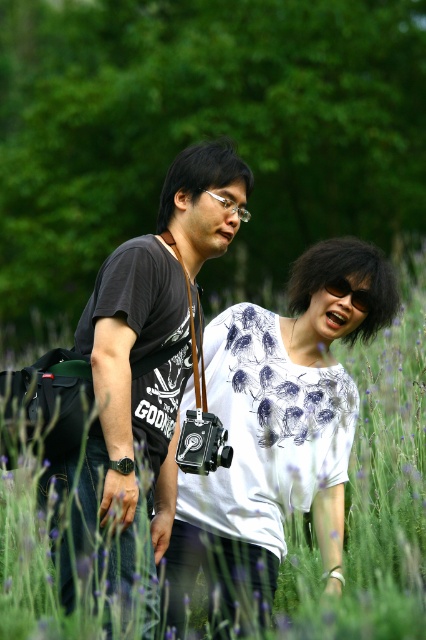
You are a photographer who wants to take a photo of the black matte camera at center and the clear plastic glasses at center. Which object should you focus on first if you want to capture both in focus?

The black matte camera at center is located below clear plastic glasses at center, so you should focus on the clear plastic glasses at center first since it is closer to the camera lens.

You are a photographer who wants to take a photo of the two people in the scene. You notice both the black matte sunglasses at center and the clear plastic glasses at center. Which item is located below the other?

The black matte sunglasses at center is positioned under the clear plastic glasses at center, so the sunglasses are below the glasses.